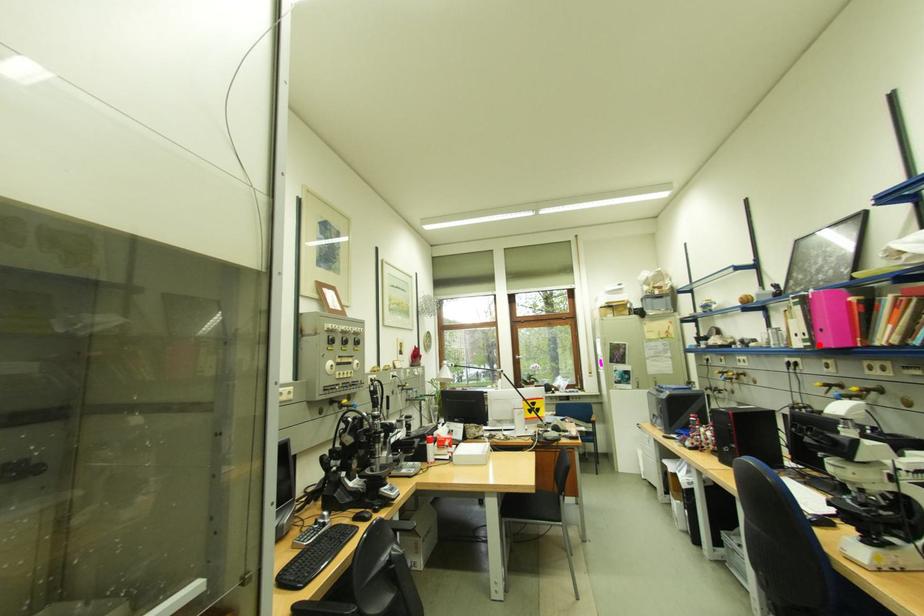
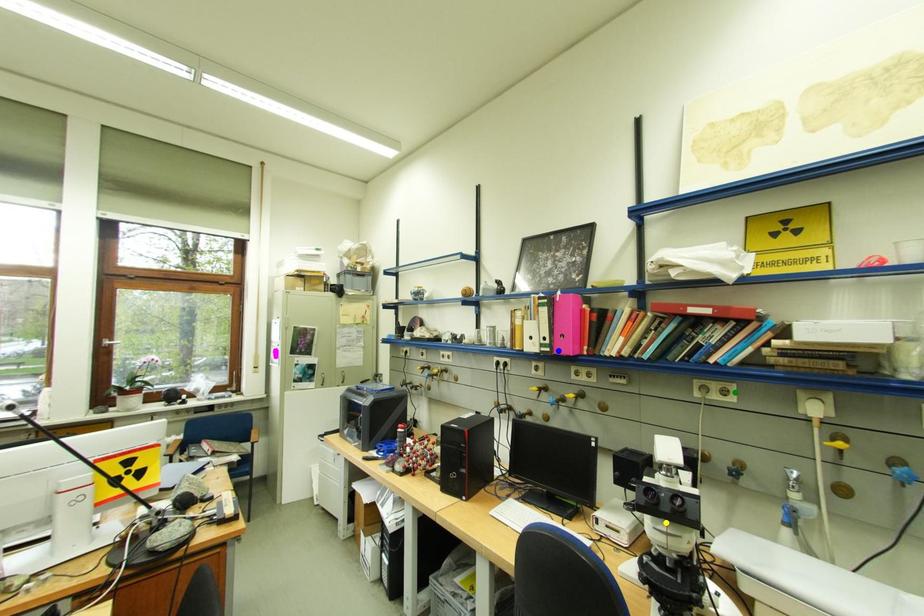
Question: I am providing you with two images of the same scene from different viewpoints. A red point is marked on the first image. You are given multiple points on the second image. Can you choose the point in image 2 that corresponds to the point in image 1?

Choices:
 (A) blue point
 (B) green point
 (C) yellow point

Answer: (A)